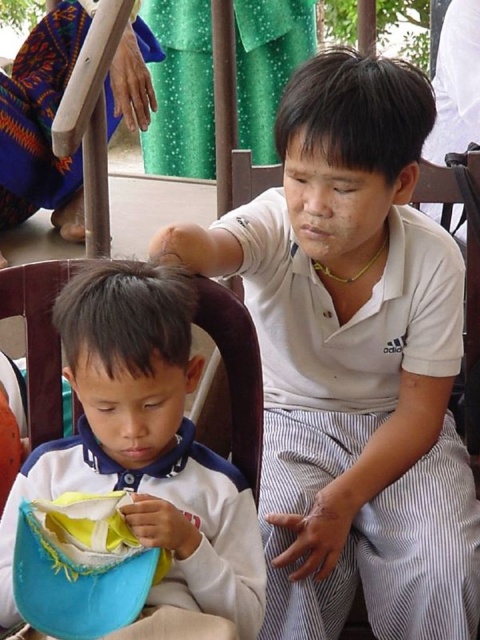
Question: Which is nearer to the white matte shirt at upper center?

Choices:
 (A) soft yellow fabric at lower left
 (B) white soft fabric at center

Answer: (B)

Question: Can you confirm if white matte shirt at upper center is positioned below soft yellow fabric at lower left?

Choices:
 (A) no
 (B) yes

Answer: (A)

Question: Where is white matte shirt at upper center located in relation to soft yellow fabric at lower left in the image?

Choices:
 (A) below
 (B) above

Answer: (B)

Question: Which of the following is the closest to the observer?

Choices:
 (A) white soft fabric at center
 (B) soft yellow fabric at lower left

Answer: (B)

Question: Can you confirm if white soft fabric at center is thinner than soft yellow fabric at lower left?

Choices:
 (A) yes
 (B) no

Answer: (B)

Question: Among these objects, which one is nearest to the camera?

Choices:
 (A) white soft fabric at center
 (B) soft yellow fabric at lower left
 (C) white matte shirt at upper center

Answer: (B)